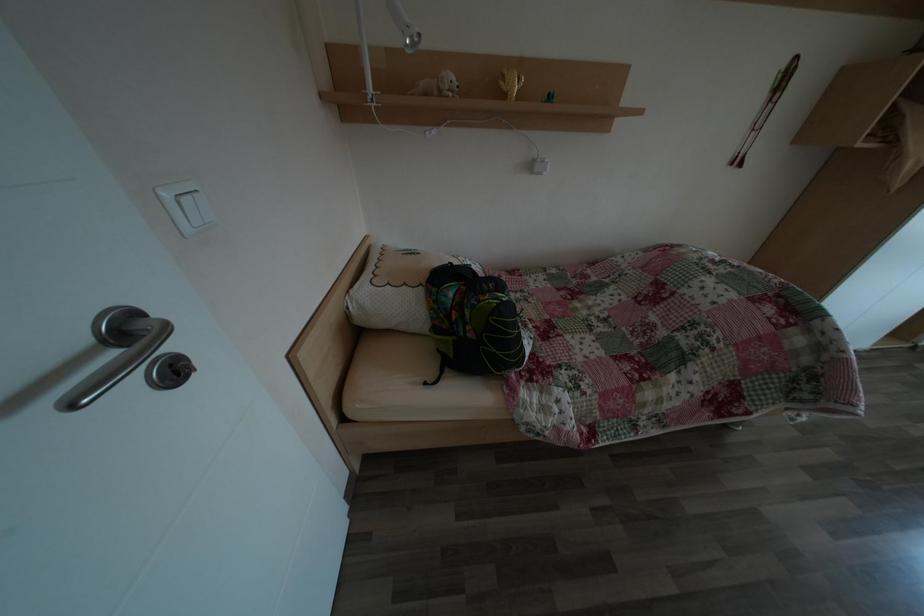
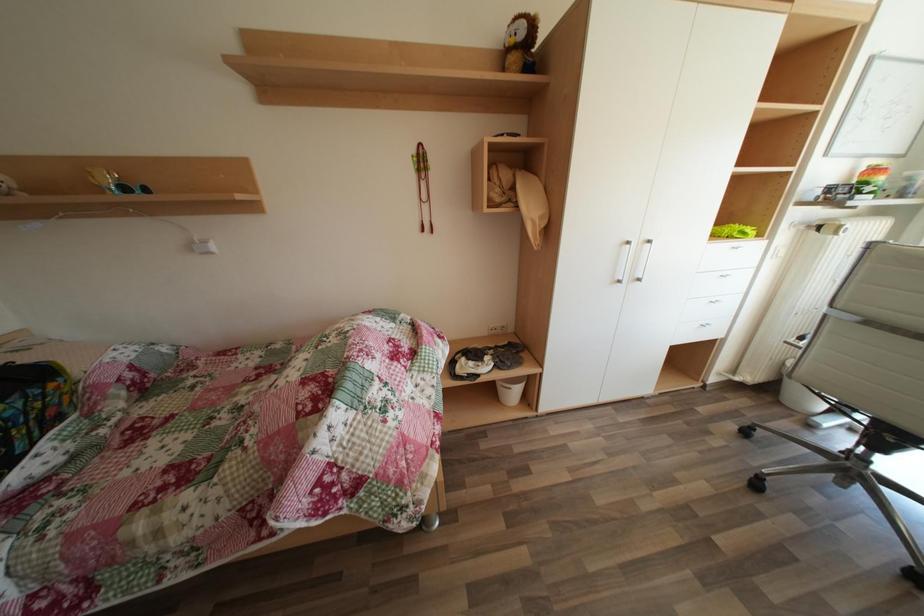
Question: The images are taken continuously from a first-person perspective. In which direction are you moving?

Choices:
 (A) Left
 (B) Right
 (C) Forward
 (D) Backward

Answer: (B)